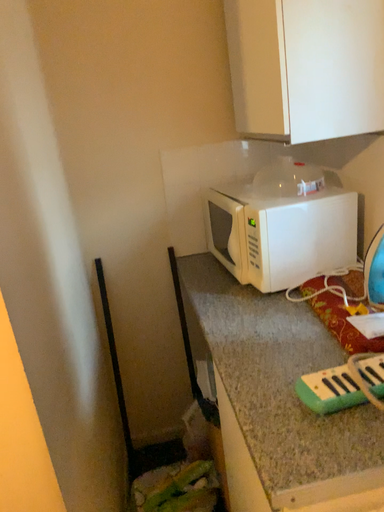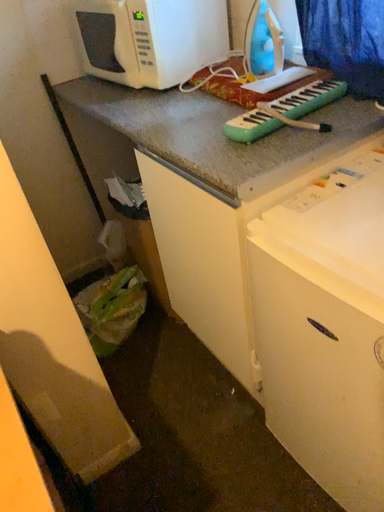
Question: Which way did the camera rotate in the video?

Choices:
 (A) rotated downward
 (B) rotated upward

Answer: (A)